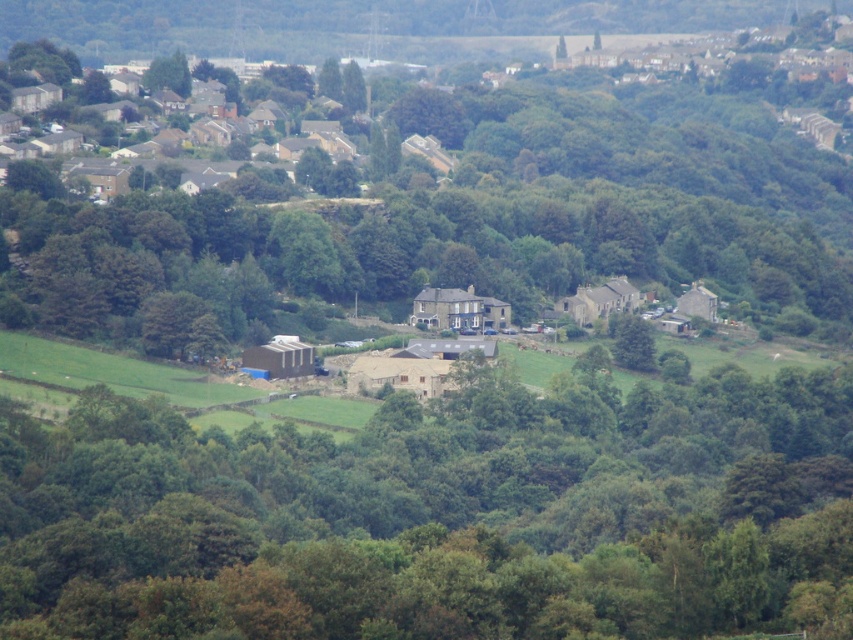
Question: Does brown wooden barn at center appear on the left side of green leafy trees at center?

Choices:
 (A) no
 (B) yes

Answer: (A)

Question: Which of the following is the farthest from the observer?

Choices:
 (A) [x=126, y=451]
 (B) [x=769, y=259]

Answer: (B)

Question: Which object is farther from the camera taking this photo?

Choices:
 (A) brown wooden barn at center
 (B) green leafy trees at center

Answer: (A)

Question: Which object appears farthest from the camera in this image?

Choices:
 (A) brown wooden barn at center
 (B) green leafy trees at center

Answer: (A)

Question: Is brown wooden barn at center in front of green leafy trees at center?

Choices:
 (A) yes
 (B) no

Answer: (B)

Question: Can you confirm if brown wooden barn at center is positioned below green leafy trees at center?

Choices:
 (A) yes
 (B) no

Answer: (A)